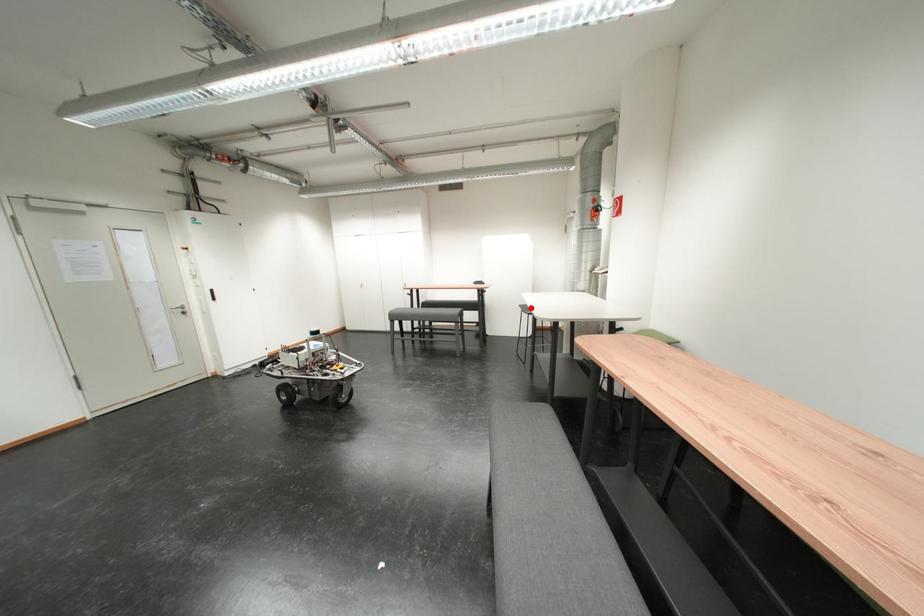
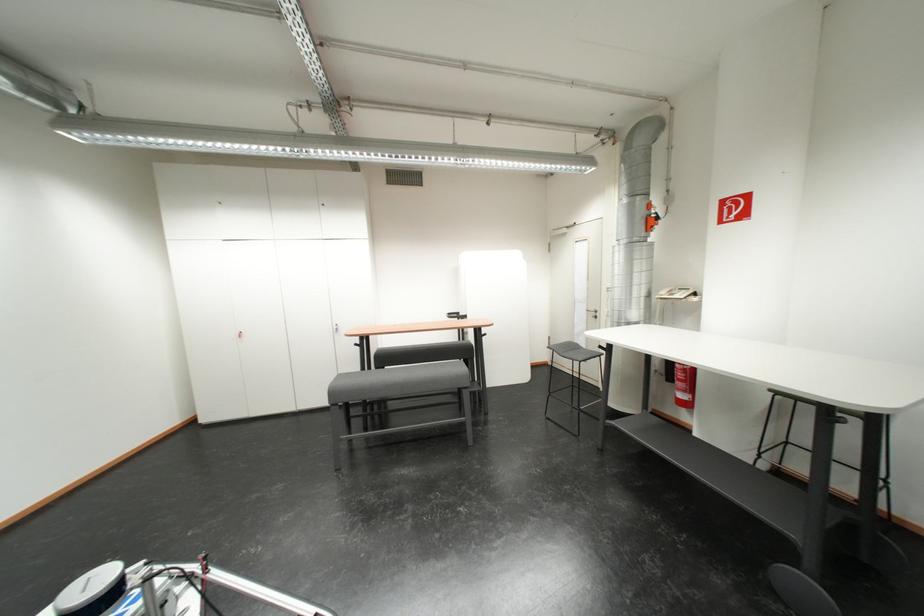
Question: I am providing you with two images of the same scene from different viewpoints. A red point is marked on the first image. At the location where the point appears in image 1, is it still visible in image 2?

Choices:
 (A) Yes
 (B) No

Answer: (A)